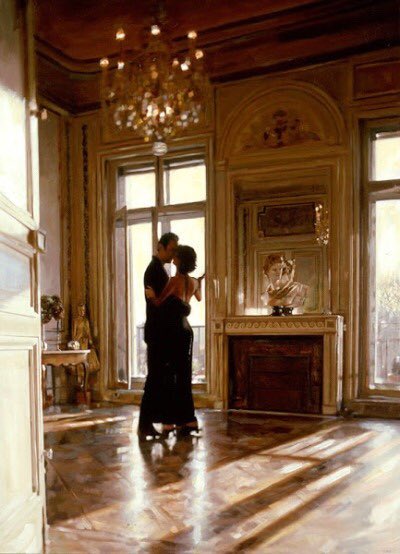
Image resolution: width=400 pixels, height=554 pixels. What are the coordinates of `side table` in the screenshot? It's located at (68, 360).